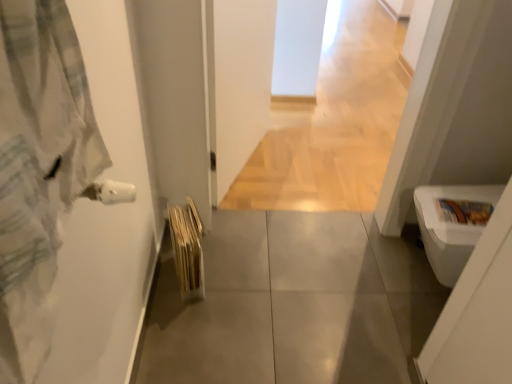
Locate an element on the screen. The height and width of the screenshot is (384, 512). free point above gray tile floor at center (from a real-world perspective) is located at coordinates (310, 281).